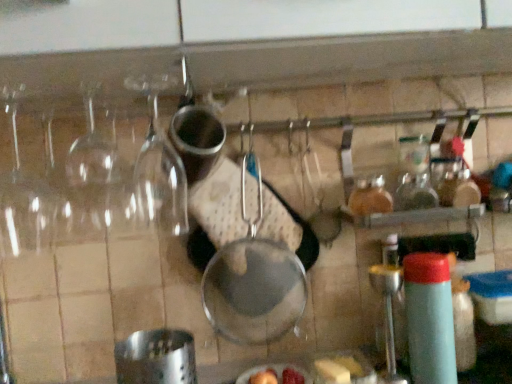
Image resolution: width=512 pixels, height=384 pixels. I want to click on yellow butter at lower right, so click(339, 369).

You are a GUI agent. You are given a task and a screenshot of the screen. Output one action in this format:
    pyautogui.click(x=<x>, y=<y>)
    Task: Click on the bottle in front of the metallic silver frying pan at center
    This screenshot has height=384, width=512.
    Given the screenshot: What is the action you would take?
    pyautogui.click(x=429, y=318)

Is metallic silver frying pan at center positioned with its back to light blue plastic bottle at right?

No.

Is metallic silver frying pan at center shorter than light blue plastic bottle at right?

No.

Which is in front, metallic silver frying pan at center or light blue plastic bottle at right?

light blue plastic bottle at right.

From the picture: From a real-world perspective, is yellow butter at lower right on metallic silver frying pan at center?

No, from a real-world perspective, yellow butter at lower right is not above metallic silver frying pan at center.

How much distance is there between yellow butter at lower right and metallic silver frying pan at center?

The distance of yellow butter at lower right from metallic silver frying pan at center is 8.01 inches.

From the image's perspective, is yellow butter at lower right located above metallic silver frying pan at center?

Incorrect, from the image's perspective, yellow butter at lower right is lower than metallic silver frying pan at center.

Is yellow butter at lower right oriented away from metallic silver frying pan at center?

No.

How far apart are light blue plastic bottle at right and yellow butter at lower right?

light blue plastic bottle at right is 7.31 inches away from yellow butter at lower right.

Consider the image. Is light blue plastic bottle at right closer to the viewer compared to yellow butter at lower right?

Yes, light blue plastic bottle at right is closer to the camera.

From a real-world perspective, which is physically above, light blue plastic bottle at right or yellow butter at lower right?

From a 3D spatial view, light blue plastic bottle at right is above.

From the image's perspective, would you say light blue plastic bottle at right is positioned over yellow butter at lower right?

Yes, from the image's perspective, light blue plastic bottle at right is on top of yellow butter at lower right.

Which point is more forward, (351, 362) or (441, 269)?

The point (441, 269) is in front.

In the image, is yellow butter at lower right on the left side or the right side of light blue plastic bottle at right?

Based on their positions, yellow butter at lower right is located to the left of light blue plastic bottle at right.

Can you confirm if yellow butter at lower right is thinner than light blue plastic bottle at right?

No.

Is yellow butter at lower right taller than light blue plastic bottle at right?

No.

Is light blue plastic bottle at right completely or partially outside of metallic silver frying pan at center?

That's correct, light blue plastic bottle at right is outside of metallic silver frying pan at center.

Where is `frying pan located above the light blue plastic bottle at right (from the image's perspective)`? frying pan located above the light blue plastic bottle at right (from the image's perspective) is located at coordinates click(x=254, y=282).

Who is taller, light blue plastic bottle at right or metallic silver frying pan at center?

Standing taller between the two is metallic silver frying pan at center.

Is light blue plastic bottle at right closer to the viewer compared to metallic silver frying pan at center?

That is True.

From the image's perspective, which one is positioned higher, metallic silver frying pan at center or yellow butter at lower right?

From the image's view, metallic silver frying pan at center is above.

Which is more to the left, metallic silver frying pan at center or yellow butter at lower right?

metallic silver frying pan at center is more to the left.

Is metallic silver frying pan at center in contact with yellow butter at lower right?

No, metallic silver frying pan at center is not next to yellow butter at lower right.

Does metallic silver frying pan at center lie in front of yellow butter at lower right?

No, it is not.

This screenshot has width=512, height=384. Find the location of `frying pan above the light blue plastic bottle at right (from the image's perspective)`. frying pan above the light blue plastic bottle at right (from the image's perspective) is located at coordinates (254, 282).

Find the location of a particular element. The height and width of the screenshot is (384, 512). frying pan to the left of yellow butter at lower right is located at coordinates (254, 282).

When comparing their distances from yellow butter at lower right, does light blue plastic bottle at right or metallic silver frying pan at center seem closer?

Among the two, light blue plastic bottle at right is located nearer to yellow butter at lower right.

Based on their spatial positions, is light blue plastic bottle at right or yellow butter at lower right closer to metallic silver frying pan at center?

Based on the image, yellow butter at lower right appears to be nearer to metallic silver frying pan at center.

Which object lies further to the anchor point light blue plastic bottle at right, yellow butter at lower right or metallic silver frying pan at center?

metallic silver frying pan at center lies further to light blue plastic bottle at right than the other object.

Based on their spatial positions, is metallic silver frying pan at center or light blue plastic bottle at right further from yellow butter at lower right?

metallic silver frying pan at center is further to yellow butter at lower right.

When comparing their distances from metallic silver frying pan at center, does yellow butter at lower right or light blue plastic bottle at right seem closer?

Among the two, yellow butter at lower right is located nearer to metallic silver frying pan at center.

Based on their spatial positions, is metallic silver frying pan at center or yellow butter at lower right further from light blue plastic bottle at right?

metallic silver frying pan at center is positioned further to the anchor light blue plastic bottle at right.

Find the location of `food between metallic silver frying pan at center and light blue plastic bottle at right in the horizontal direction`. food between metallic silver frying pan at center and light blue plastic bottle at right in the horizontal direction is located at coordinates (339, 369).